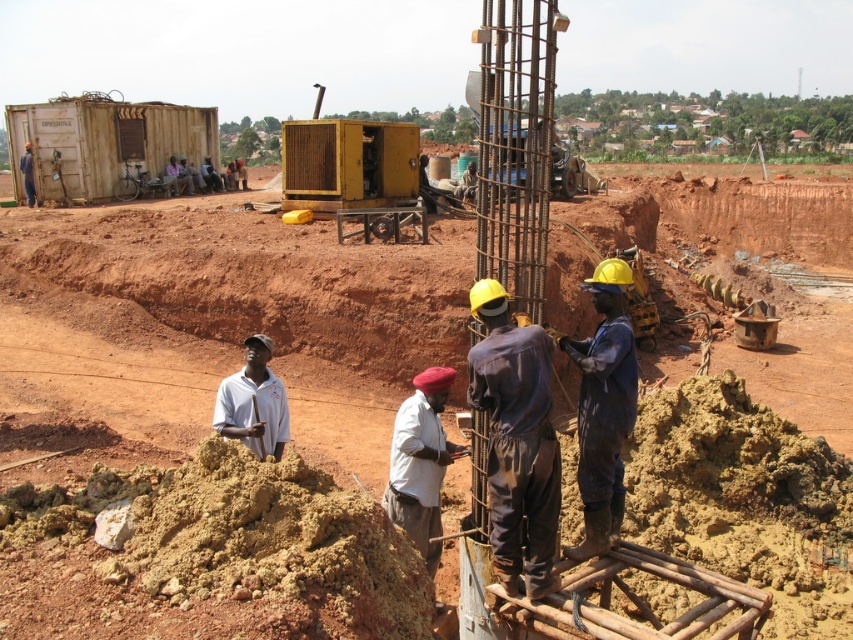
Question: Based on their relative distances, which object is farther from the blue coveralls at center?

Choices:
 (A) metallic yellow generator at center
 (B) dark blue fabric at center
 (C) white fabric at center
 (D) dark blue jumpsuit at center

Answer: (D)

Question: Is blue coveralls at center thinner than dark blue jumpsuit at center?

Choices:
 (A) yes
 (B) no

Answer: (A)

Question: Estimate the real-world distances between objects in this image. Which object is farther from the metallic yellow generator at center?

Choices:
 (A) dark blue jumpsuit at center
 (B) dark blue fabric at center
 (C) white matte shirt at center

Answer: (A)

Question: Is blue coveralls at center positioned in front of white fabric at center?

Choices:
 (A) yes
 (B) no

Answer: (A)

Question: Is blue coveralls at center below dark blue jumpsuit at center?

Choices:
 (A) no
 (B) yes

Answer: (B)

Question: Which point is closer to the camera?

Choices:
 (A) (41, 378)
 (B) (389, 477)
 (C) (30, 193)

Answer: (B)